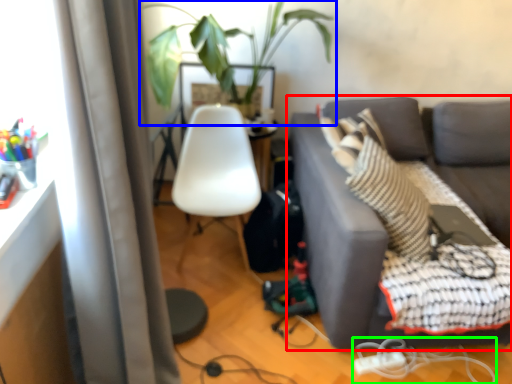
Question: Which is nearer to the studio couch (highlighted by a red box)? houseplant (highlighted by a blue box) or cable (highlighted by a green box).

Choices:
 (A) houseplant
 (B) cable

Answer: (B)